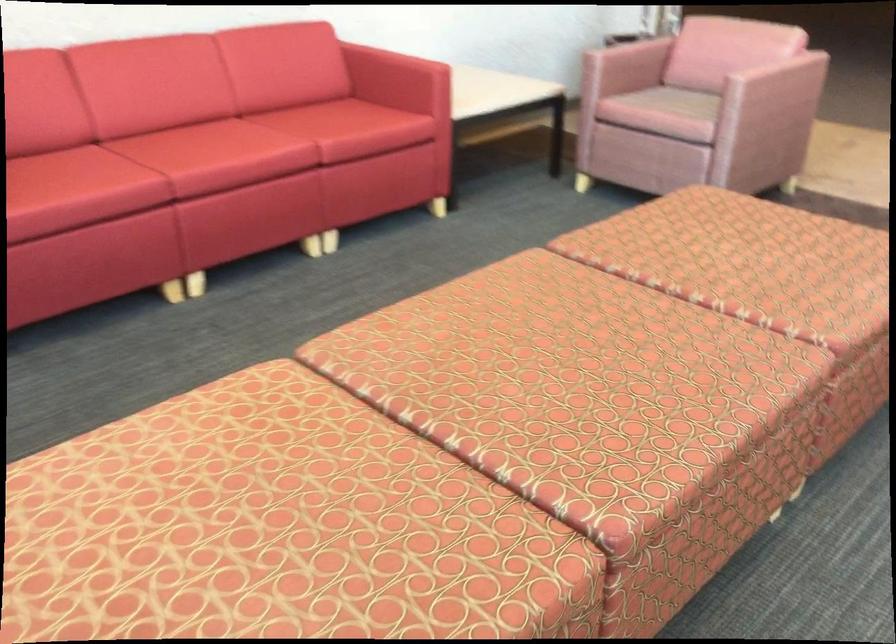
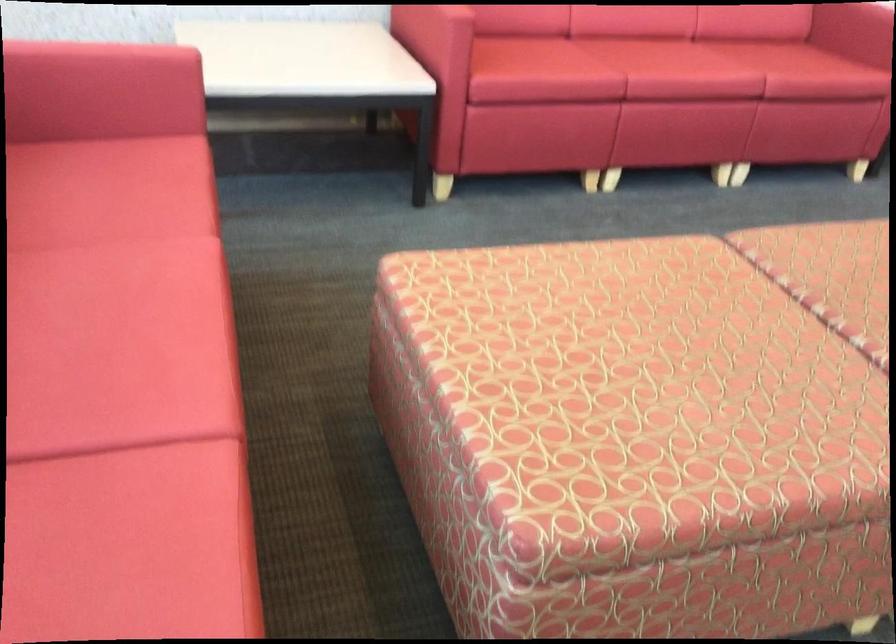
Question: Based on the continuous images, in which direction is the camera rotating? Reply with the corresponding letter.

Choices:
 (A) Left
 (B) Right
 (C) Up
 (D) Down

Answer: (A)